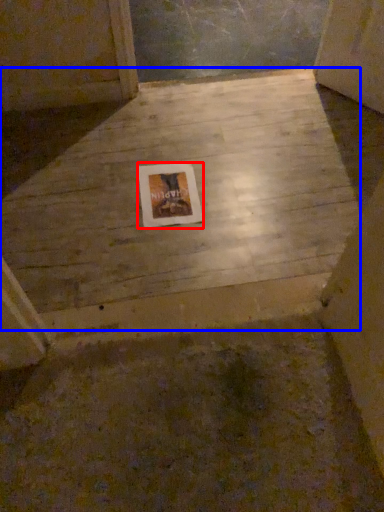
Question: Which point is closer to the camera, picture frame (highlighted by a red box) or concrete (highlighted by a blue box)?

Choices:
 (A) picture frame
 (B) concrete

Answer: (B)